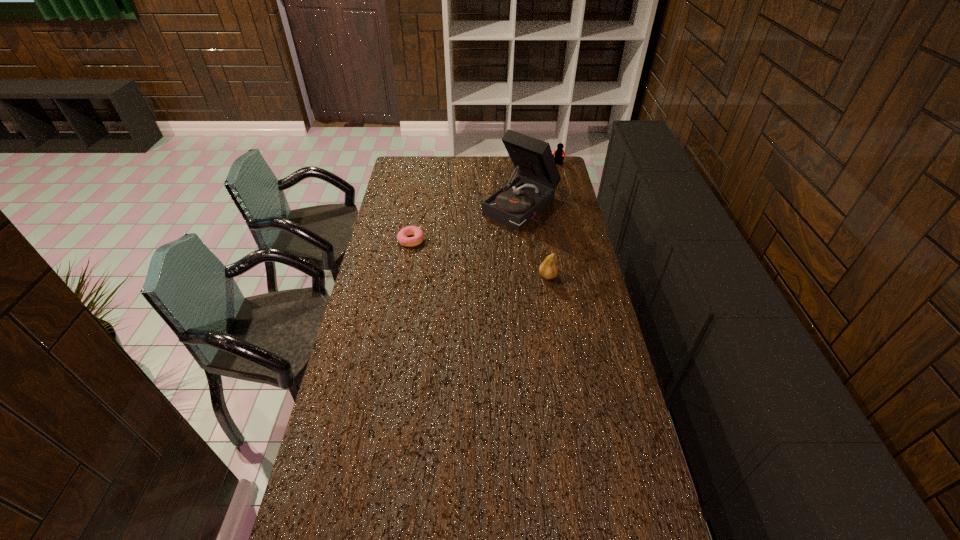
Where is `free space at the far edge of the desktop`? The width and height of the screenshot is (960, 540). free space at the far edge of the desktop is located at coordinates (431, 158).

Image resolution: width=960 pixels, height=540 pixels. I want to click on vacant space at the left edge of the desktop, so click(x=401, y=218).

Image resolution: width=960 pixels, height=540 pixels. In the image, there is a desktop. In order to click on vacant space at the right edge in this screenshot , I will do `click(582, 274)`.

Locate an element on the screen. This screenshot has width=960, height=540. free space at the far left corner of the desktop is located at coordinates (406, 178).

You are a GUI agent. You are given a task and a screenshot of the screen. Output one action in this format:
    pyautogui.click(x=<x>, y=<y>)
    Task: Click on the free space between the shortest object and the pear
    Image resolution: width=960 pixels, height=540 pixels.
    Given the screenshot: What is the action you would take?
    pyautogui.click(x=479, y=258)

I want to click on free space between the nearest object and the tallest object, so click(535, 241).

What are the coordinates of `unoccupied area between the farthest object and the nearest object` in the screenshot? It's located at (552, 220).

Image resolution: width=960 pixels, height=540 pixels. I want to click on vacant space that is in between the tallest object and the doughnut, so click(x=467, y=222).

Find the location of a particular element. vacant space that is in between the tallest object and the pear is located at coordinates (535, 241).

This screenshot has width=960, height=540. I want to click on free space between the doughnut and the tallest object, so click(467, 222).